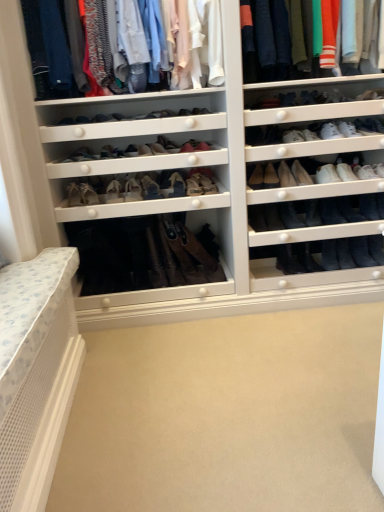
Question: Is beige carpet at lower center behind matte white shirts at upper center?

Choices:
 (A) no
 (B) yes

Answer: (A)

Question: From the image's perspective, is beige carpet at lower center beneath matte white shirts at upper center?

Choices:
 (A) no
 (B) yes

Answer: (B)

Question: Would you say beige carpet at lower center contains matte white shirts at upper center?

Choices:
 (A) no
 (B) yes

Answer: (A)

Question: Does beige carpet at lower center have a smaller size compared to matte white shirts at upper center?

Choices:
 (A) no
 (B) yes

Answer: (B)

Question: Is beige carpet at lower center outside of matte white shirts at upper center?

Choices:
 (A) yes
 (B) no

Answer: (A)

Question: Does beige carpet at lower center touch matte white shirts at upper center?

Choices:
 (A) no
 (B) yes

Answer: (A)

Question: From a real-world perspective, does white leather sneaker at upper right, positioned as the eighteenth shoe in left-to-right order, stand above matte white shoe at center, which appears as the eighteenth shoe when viewed from the right?

Choices:
 (A) yes
 (B) no

Answer: (A)

Question: Is white leather sneaker at upper right, acting as the 4th shoe starting from the right, bigger than matte white shoe at center, positioned as the fourth shoe in left-to-right order?

Choices:
 (A) no
 (B) yes

Answer: (A)

Question: Can you confirm if white leather sneaker at upper right, acting as the 4th shoe starting from the right, is shorter than matte white shoe at center, positioned as the fourth shoe in left-to-right order?

Choices:
 (A) yes
 (B) no

Answer: (A)

Question: Is white leather sneaker at upper right, acting as the 4th shoe starting from the right, not within matte white shoe at center, positioned as the fourth shoe in left-to-right order?

Choices:
 (A) yes
 (B) no

Answer: (A)

Question: Is the depth of white leather sneaker at upper right, positioned as the eighteenth shoe in left-to-right order, greater than that of matte white shoe at center, which appears as the eighteenth shoe when viewed from the right?

Choices:
 (A) yes
 (B) no

Answer: (B)

Question: From the image's perspective, is white leather sneaker at upper right, acting as the 4th shoe starting from the right, under matte white shoe at center, which appears as the eighteenth shoe when viewed from the right?

Choices:
 (A) no
 (B) yes

Answer: (A)

Question: Would you consider leather tan boot at center, the 14th shoe in the right-to-left sequence, to be distant from black leather boot at lower right, which is counted as the fifteenth shoe, starting from the left?

Choices:
 (A) yes
 (B) no

Answer: (B)